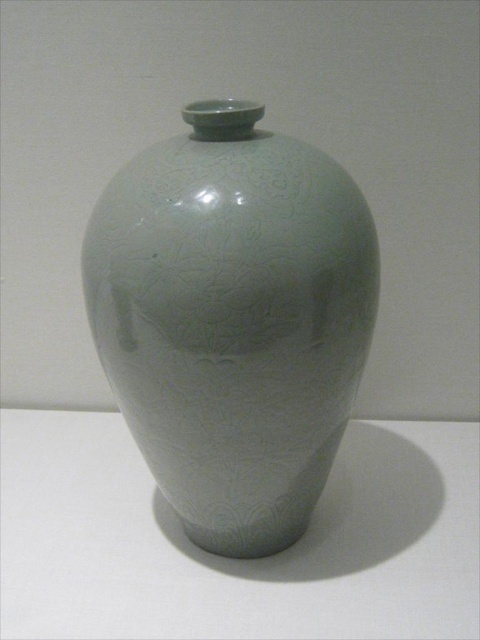
Between matte porcelain vase at center and white glossy table at center, which one appears on the right side from the viewer's perspective?

Positioned to the right is matte porcelain vase at center.

Locate an element on the screen. The height and width of the screenshot is (640, 480). matte porcelain vase at center is located at coordinates (x=233, y=320).

This screenshot has height=640, width=480. What do you see at coordinates (233, 320) in the screenshot?
I see `matte porcelain vase at center` at bounding box center [233, 320].

Where is `matte porcelain vase at center`? matte porcelain vase at center is located at coordinates (233, 320).